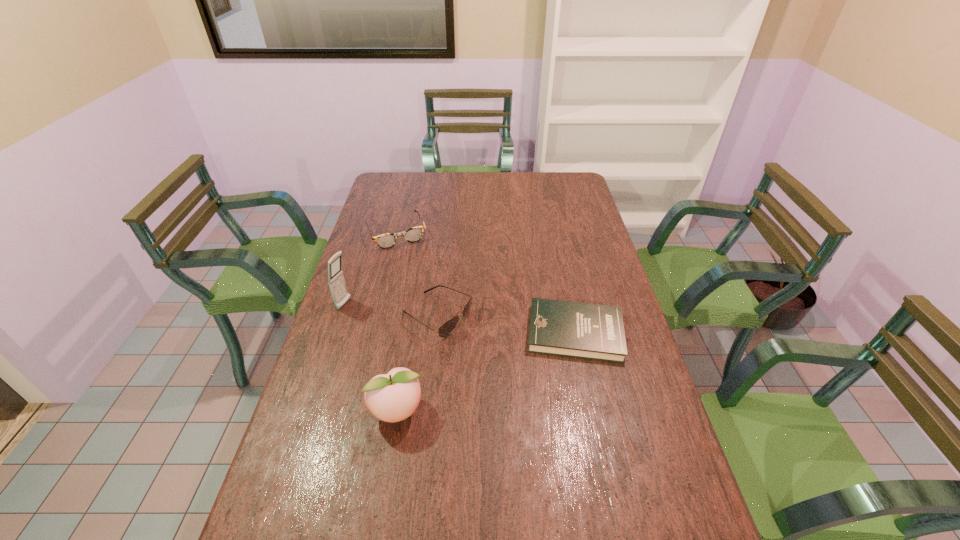
Image resolution: width=960 pixels, height=540 pixels. I want to click on vacant spot on the desktop that is between the peach and the book and is positioned on the front-facing side of the sunglasses, so click(x=517, y=358).

I want to click on free spot on the desktop that is between the fourth shortest object and the book and is positioned on the front-facing side of the cellular telephone, so click(507, 363).

Locate an element on the screen. vacant space on the desktop that is between the nearest object and the rightmost object and is positioned on the frame of the farthest object is located at coordinates (467, 381).